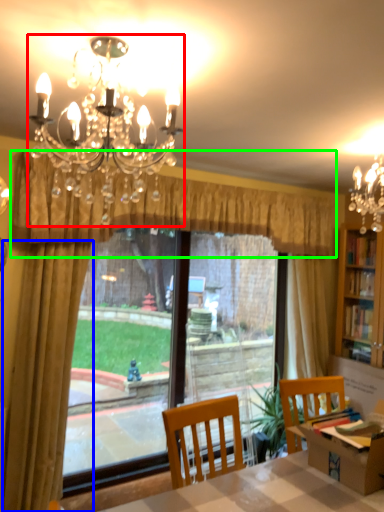
Question: Which object is positioned closest to lamp (highlighted by a red box)? Select from curtain (highlighted by a blue box) and curtain (highlighted by a green box).

Choices:
 (A) curtain
 (B) curtain

Answer: (B)